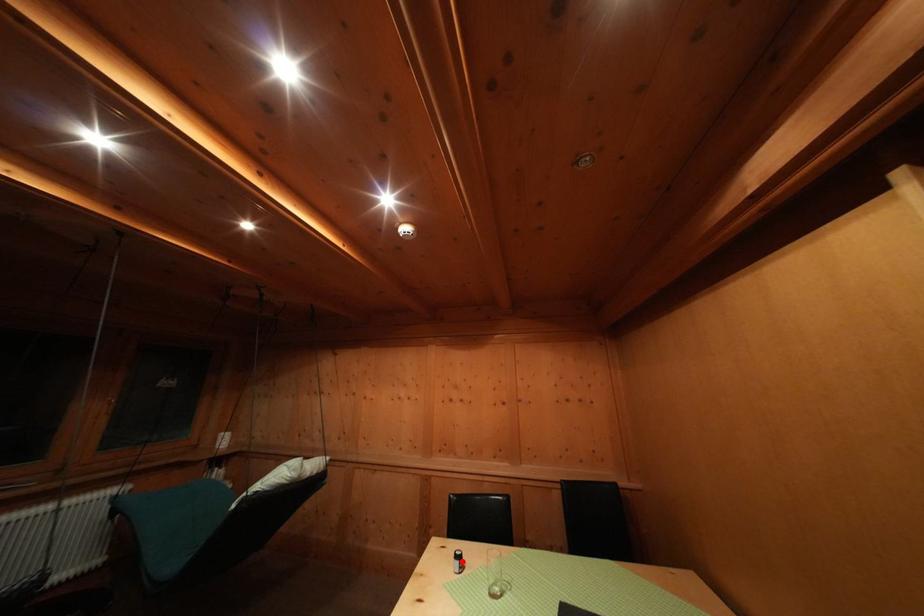
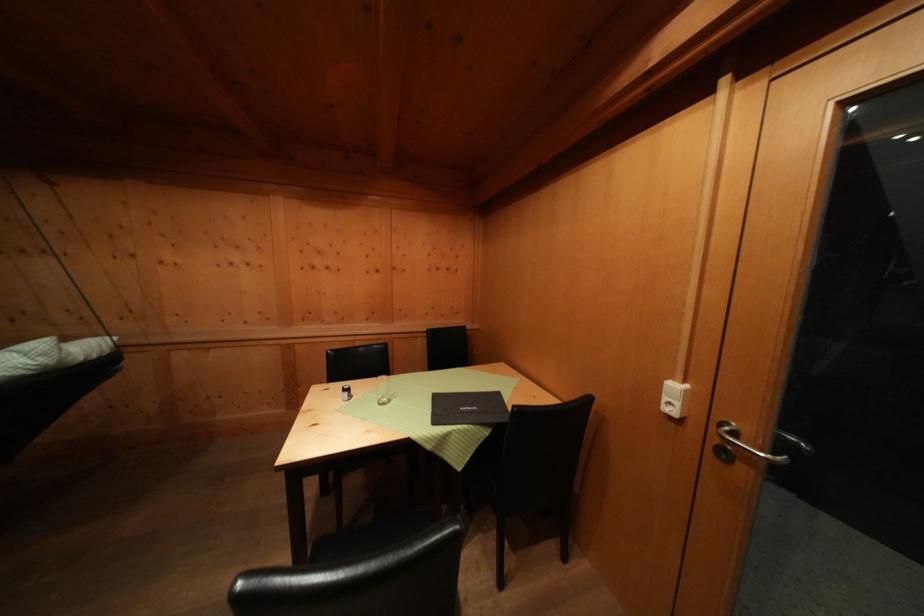
Question: I am providing you with two images of the same scene from different viewpoints. Image1 has a red point marked. In image2, the corresponding 3D location appears at what relative position? Reply with the corresponding letter.

Choices:
 (A) Closer
 (B) Farther

Answer: (B)